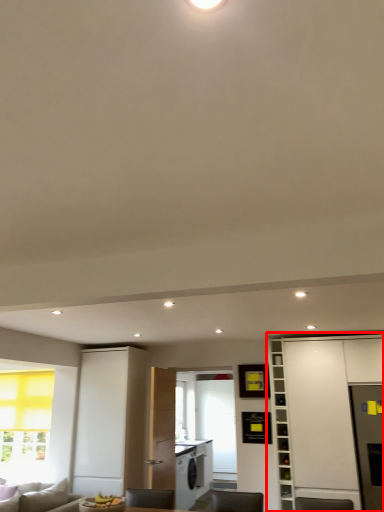
Question: Observing the image, what is the correct spatial positioning of cabinetry (annotated by the red box) in reference to bookshelf?

Choices:
 (A) right
 (B) left

Answer: (A)